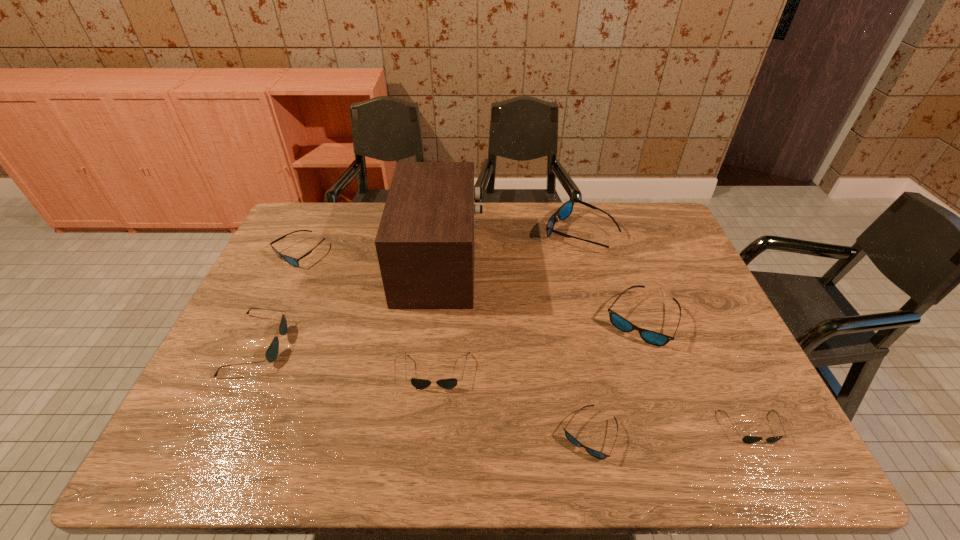
In order to click on free area in between the second black sunglasses from left to right and the third smallest blue sunglasses in this screenshot , I will do click(x=539, y=346).

Locate an element on the screen. The width and height of the screenshot is (960, 540). unoccupied area between the second smallest blue sunglasses and the third sunglasses from left to right is located at coordinates (368, 312).

Identify the location of vacant space that is in between the tallest object and the smallest blue sunglasses. Image resolution: width=960 pixels, height=540 pixels. (515, 349).

What are the coordinates of `vacant region between the smallest blue sunglasses and the smallest black sunglasses` in the screenshot? It's located at (670, 431).

You are a GUI agent. You are given a task and a screenshot of the screen. Output one action in this format:
    pyautogui.click(x=<x>, y=<y>)
    Task: Click on the free point between the smallest blue sunglasses and the rightmost black sunglasses
    The height and width of the screenshot is (540, 960).
    Given the screenshot: What is the action you would take?
    pyautogui.click(x=670, y=431)

Find the location of `free space that is in between the tallest object and the third sunglasses from left to right`. free space that is in between the tallest object and the third sunglasses from left to right is located at coordinates (438, 317).

The width and height of the screenshot is (960, 540). I want to click on blank region between the leftmost black sunglasses and the nearest blue sunglasses, so click(x=423, y=390).

At what (x,y) coordinates should I click in order to perform the action: click on vacant space in between the leftmost black sunglasses and the third farthest blue sunglasses. Please return your answer as a coordinate pair (x, y). The height and width of the screenshot is (540, 960). Looking at the image, I should click on (449, 333).

In order to click on empty space between the leftmost blue sunglasses and the nearest blue sunglasses in this screenshot , I will do `click(444, 343)`.

Where is `object that ranks as the second closest to the smallest black sunglasses`? This screenshot has width=960, height=540. object that ranks as the second closest to the smallest black sunglasses is located at coordinates (574, 441).